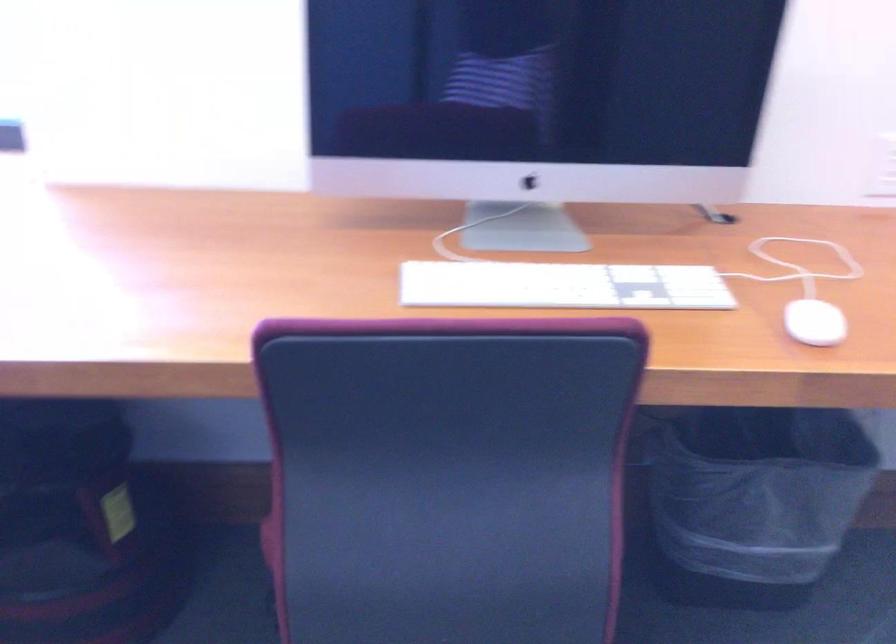
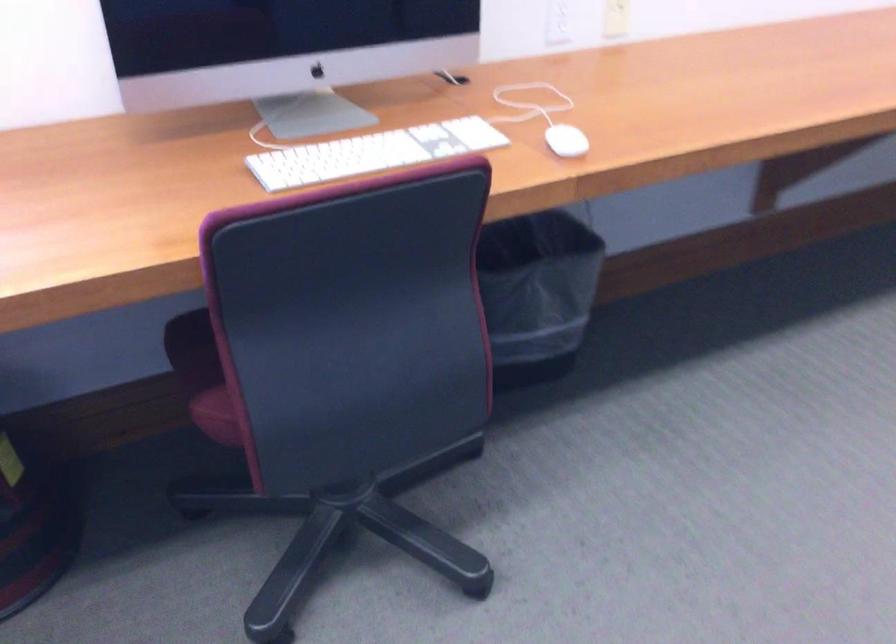
Find the pixel in the second image that matches (x=546, y=283) in the first image.

(372, 153)